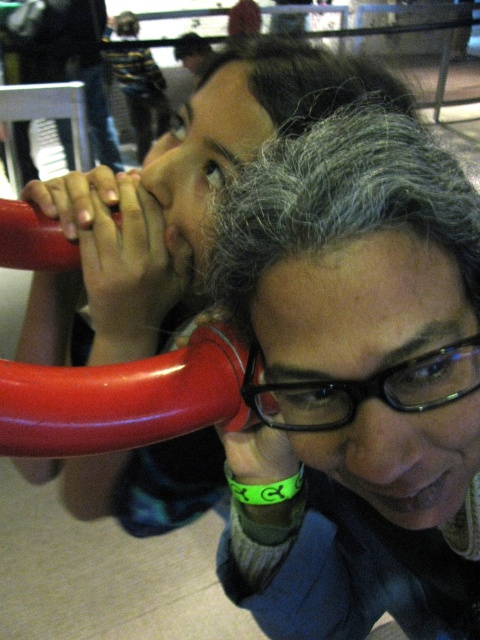
You are designing a seating arrangement for a small meeting room. The room has two chairs placed side by side. The first chair is for the person with gray hair at center, and the second chair is for the person with matte black hair at center. Based on the scene description, which chair should be wider to accommodate the respective individuals?

The second chair for the matte black hair at center should be wider since the matte black hair at center has a greater width than the gray hair at center according to the description.

You are standing in the scene and want to locate the matte black hair at center. What are the coordinates where you can find it?

The matte black hair at center is located at coordinates point (x=178, y=198).